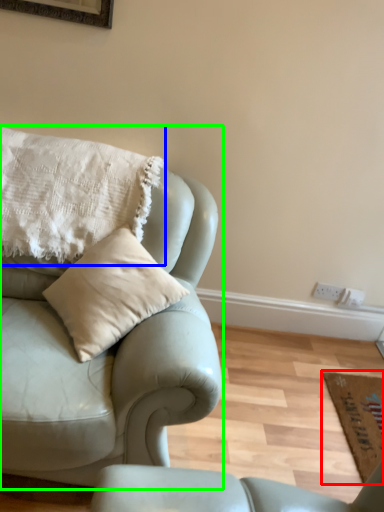
Question: Which object is positioned farthest from mat (highlighted by a red box)? Select from pillow (highlighted by a blue box) and studio couch (highlighted by a green box).

Choices:
 (A) pillow
 (B) studio couch

Answer: (A)